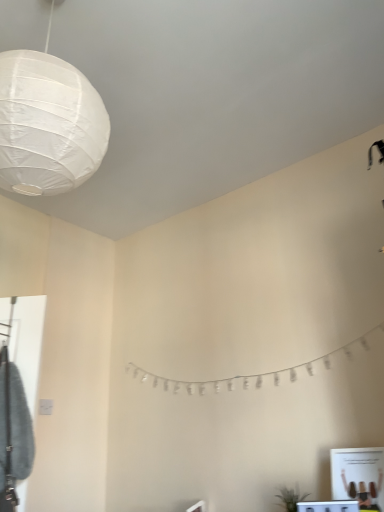
Question: From a real-world perspective, is green matte plant at lower right physically located above or below white glossy vanity at lower right?

Choices:
 (A) below
 (B) above

Answer: (B)

Question: From the image's perspective, is green matte plant at lower right positioned above or below white glossy vanity at lower right?

Choices:
 (A) above
 (B) below

Answer: (B)

Question: Which object is positioned closest to the white paper garland at center?

Choices:
 (A) white glossy vanity at lower right
 (B) green matte plant at lower right
 (C) white paper lantern at upper left

Answer: (B)

Question: Based on their relative distances, which object is farther from the green matte plant at lower right?

Choices:
 (A) white paper garland at center
 (B) white paper lantern at upper left
 (C) white glossy vanity at lower right

Answer: (B)